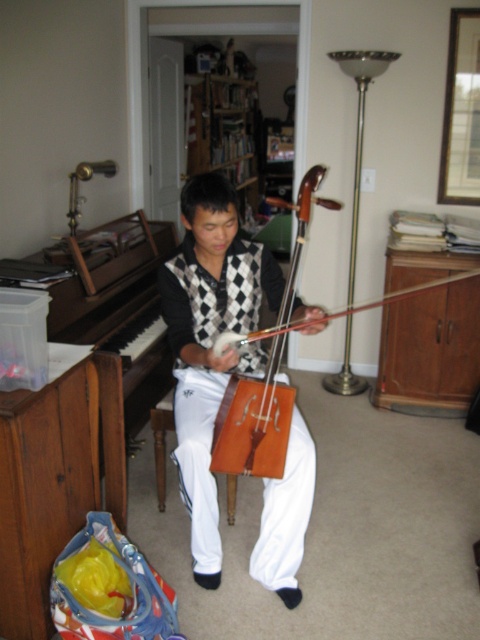
Which is more to the left, wooden violin at center or wooden cello at center?

wooden violin at center is more to the left.

Can you confirm if wooden violin at center is taller than wooden cello at center?

Yes, wooden violin at center is taller than wooden cello at center.

Between point (227, 204) and point (220, 424), which one is positioned in front?

Point (220, 424)

Where is `wooden violin at center`? The height and width of the screenshot is (640, 480). wooden violin at center is located at coordinates (211, 340).

Is brown polished wood piano at left above brown wood stool at lower center?

Yes.

Does brown polished wood piano at left have a smaller size compared to brown wood stool at lower center?

No, brown polished wood piano at left is not smaller than brown wood stool at lower center.

What do you see at coordinates (105, 282) in the screenshot?
I see `brown polished wood piano at left` at bounding box center [105, 282].

Where is `brown polished wood piano at left`? Image resolution: width=480 pixels, height=640 pixels. brown polished wood piano at left is located at coordinates (105, 282).

Is point (48, 268) more distant than point (309, 218)?

Yes, point (48, 268) is farther from viewer.

Identify the location of brown polished wood piano at left. This screenshot has height=640, width=480. tap(105, 282).

Locate an element on the screen. Image resolution: width=480 pixels, height=640 pixels. brown polished wood piano at left is located at coordinates (105, 282).